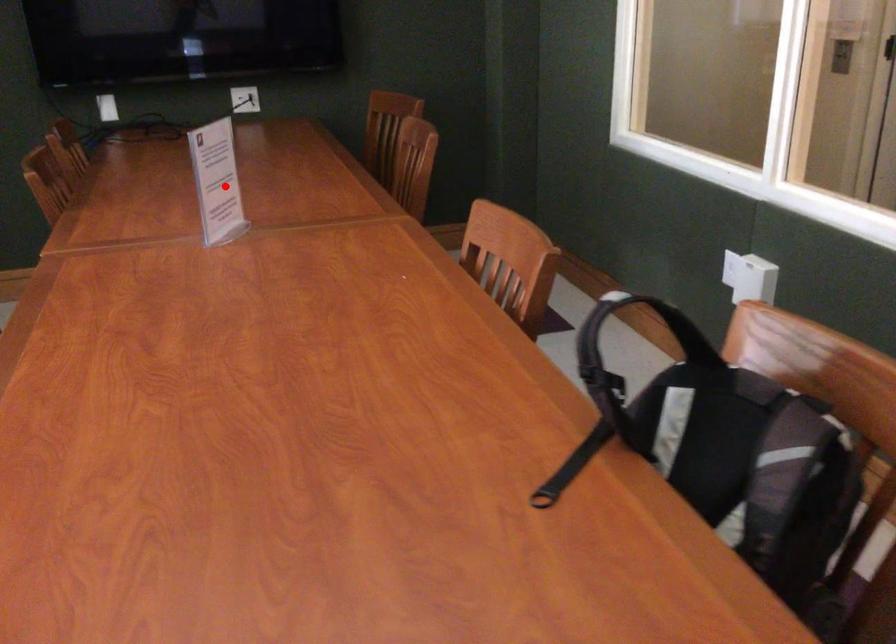
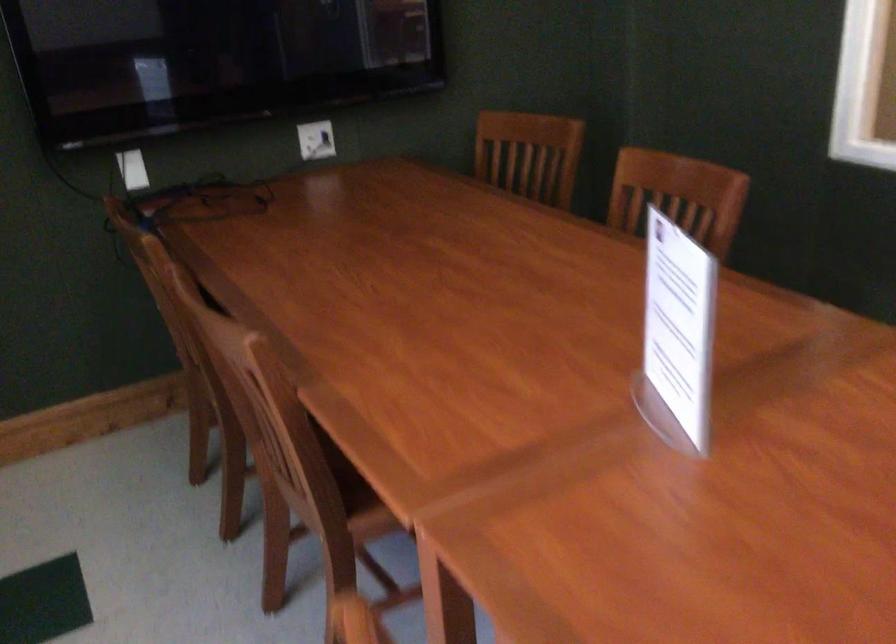
Question: A red point is marked in image1. In image2, is the corresponding 3D point closer to the camera or farther? Reply with the corresponding letter.

Choices:
 (A) The corresponding 3D point is closer.
 (B) The corresponding 3D point is farther.

Answer: (A)